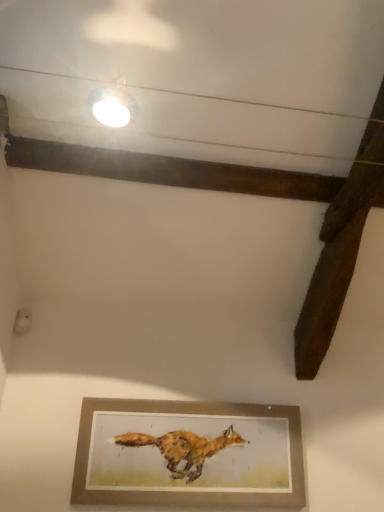
Identify the location of white glossy light fixture at upper center. This screenshot has height=512, width=384. (112, 106).

This screenshot has width=384, height=512. What do you see at coordinates (112, 106) in the screenshot?
I see `white glossy light fixture at upper center` at bounding box center [112, 106].

What is the approximate width of wooden picture frame at lower center?

1.90 inches.

This screenshot has width=384, height=512. Find the location of `wooden picture frame at lower center`. wooden picture frame at lower center is located at coordinates (188, 454).

What do you see at coordinates (188, 454) in the screenshot? I see `wooden picture frame at lower center` at bounding box center [188, 454].

At what (x,y) coordinates should I click in order to perform the action: click on white glossy light fixture at upper center. Please return your answer as a coordinate pair (x, y). The width and height of the screenshot is (384, 512). Looking at the image, I should click on (112, 106).

Can you confirm if wooden picture frame at lower center is positioned to the left of white glossy light fixture at upper center?

No.

Does wooden picture frame at lower center lie in front of white glossy light fixture at upper center?

No, it is behind white glossy light fixture at upper center.

Is point (150, 424) positioned after point (109, 125)?

That is True.

From the image's perspective, is wooden picture frame at lower center located above white glossy light fixture at upper center?

No, from the image's perspective, wooden picture frame at lower center is not above white glossy light fixture at upper center.

From a real-world perspective, relative to white glossy light fixture at upper center, is wooden picture frame at lower center vertically above or below?

Clearly, from a real-world perspective, wooden picture frame at lower center is below white glossy light fixture at upper center.

Is wooden picture frame at lower center wider than white glossy light fixture at upper center?

No.

Does wooden picture frame at lower center have a lesser height compared to white glossy light fixture at upper center?

In fact, wooden picture frame at lower center may be taller than white glossy light fixture at upper center.

Based on their sizes in the image, would you say wooden picture frame at lower center is bigger or smaller than white glossy light fixture at upper center?

wooden picture frame at lower center is bigger than white glossy light fixture at upper center.

Is wooden picture frame at lower center positioned beyond the bounds of white glossy light fixture at upper center?

wooden picture frame at lower center lies outside white glossy light fixture at upper center's area.

Is wooden picture frame at lower center in contact with white glossy light fixture at upper center?

wooden picture frame at lower center and white glossy light fixture at upper center are clearly separated.

In the scene shown: Is wooden picture frame at lower center facing away from white glossy light fixture at upper center?

No.

How many degrees apart are the facing directions of wooden picture frame at lower center and white glossy light fixture at upper center?

There is a 91.1-degree angle between the facing directions of wooden picture frame at lower center and white glossy light fixture at upper center.

How far apart are wooden picture frame at lower center and white glossy light fixture at upper center?

They are 4.78 feet apart.

Identify the location of light fixture above the wooden picture frame at lower center (from a real-world perspective). The width and height of the screenshot is (384, 512). (112, 106).

In the image, is white glossy light fixture at upper center on the left side or the right side of wooden picture frame at lower center?

Clearly, white glossy light fixture at upper center is on the left of wooden picture frame at lower center in the image.

Considering their positions, is white glossy light fixture at upper center located in front of or behind wooden picture frame at lower center?

Clearly, white glossy light fixture at upper center is in front of wooden picture frame at lower center.

Considering the positions of points (135, 111) and (276, 411), is point (135, 111) farther from camera compared to point (276, 411)?

No, (135, 111) is closer to viewer.

From the image's perspective, is white glossy light fixture at upper center located above or below wooden picture frame at lower center?

white glossy light fixture at upper center is above wooden picture frame at lower center.

From a real-world perspective, which object stands above the other?

white glossy light fixture at upper center, from a real-world perspective.

Which object is thinner, white glossy light fixture at upper center or wooden picture frame at lower center?

wooden picture frame at lower center.

From the picture: In terms of height, does white glossy light fixture at upper center look taller or shorter compared to wooden picture frame at lower center?

In the image, white glossy light fixture at upper center appears to be shorter than wooden picture frame at lower center.

In terms of size, does white glossy light fixture at upper center appear bigger or smaller than wooden picture frame at lower center?

Clearly, white glossy light fixture at upper center is smaller in size than wooden picture frame at lower center.

Can wooden picture frame at lower center be found inside white glossy light fixture at upper center?

No, white glossy light fixture at upper center does not contain wooden picture frame at lower center.

Would you consider white glossy light fixture at upper center to be distant from wooden picture frame at lower center?

white glossy light fixture at upper center is positioned a significant distance from wooden picture frame at lower center.

In the scene shown: Could you tell me if white glossy light fixture at upper center is facing wooden picture frame at lower center?

No.

How many degrees apart are the facing directions of white glossy light fixture at upper center and wooden picture frame at lower center?

white glossy light fixture at upper center and wooden picture frame at lower center are facing 91.1 degrees away from each other.

Where is `picture frame that is under the white glossy light fixture at upper center (from a real-world perspective)`? Image resolution: width=384 pixels, height=512 pixels. picture frame that is under the white glossy light fixture at upper center (from a real-world perspective) is located at coordinates (188, 454).

Locate an element on the screen. The width and height of the screenshot is (384, 512). picture frame below the white glossy light fixture at upper center (from the image's perspective) is located at coordinates [x=188, y=454].

The image size is (384, 512). Identify the location of light fixture in front of the wooden picture frame at lower center. (112, 106).